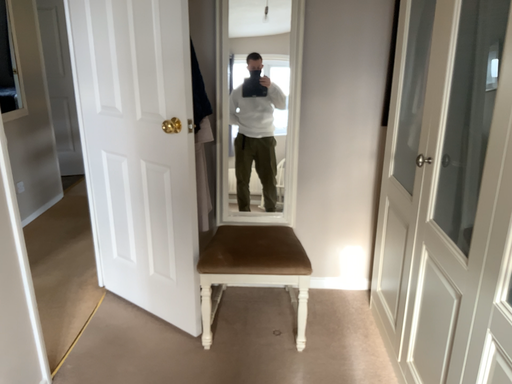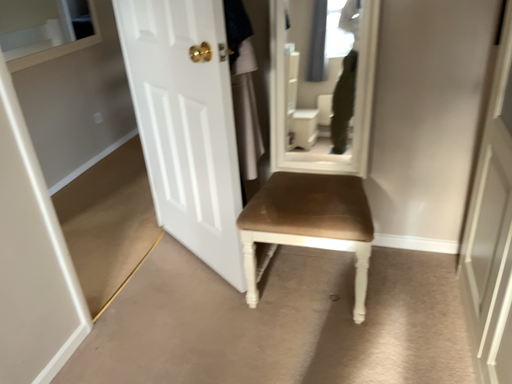
Question: Which way did the camera rotate in the video?

Choices:
 (A) rotated upward
 (B) rotated downward

Answer: (B)